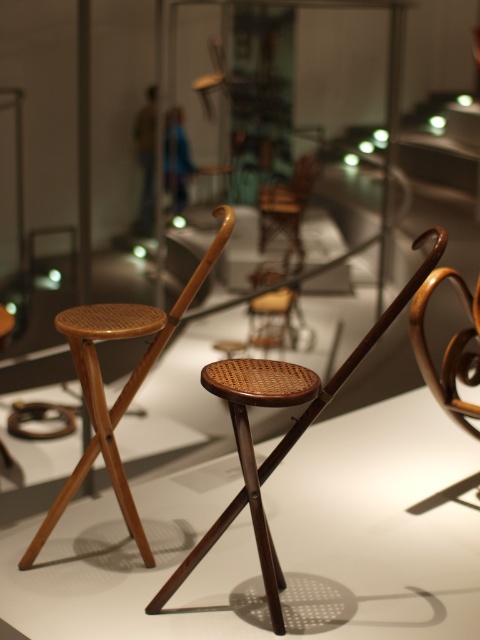
Question: Does woven wood folding chair at center have a lesser width compared to woven wood chair at center?

Choices:
 (A) yes
 (B) no

Answer: (B)

Question: Is woven wood stool at center above brown woven wood chair at center?

Choices:
 (A) yes
 (B) no

Answer: (B)

Question: Is woven wood folding chair at center to the left of woven wood stool at center from the viewer's perspective?

Choices:
 (A) no
 (B) yes

Answer: (A)

Question: Which of the following is the farthest from the observer?

Choices:
 (A) (298, 163)
 (B) (143, 358)
 (C) (450, 378)

Answer: (A)

Question: Estimate the real-world distances between objects in this image. Which object is farther from the woven wood folding chair at center?

Choices:
 (A) woven wood stool at center
 (B) woven wood chair at center
 (C) brown woven wood chair at center

Answer: (B)

Question: Which object appears closest to the camera in this image?

Choices:
 (A) woven wood stool at center
 (B) woven wood folding chair at center
 (C) brown woven wood chair at center

Answer: (B)